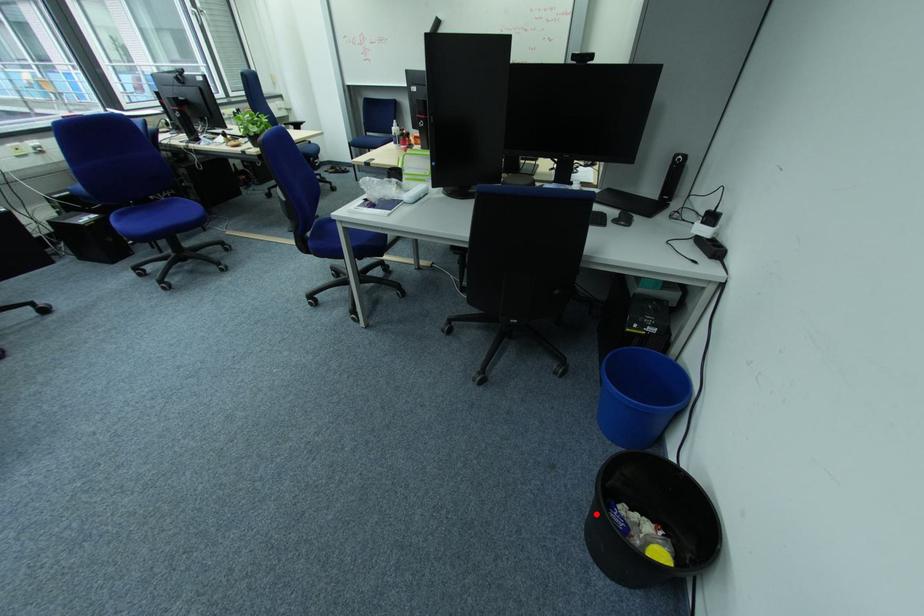
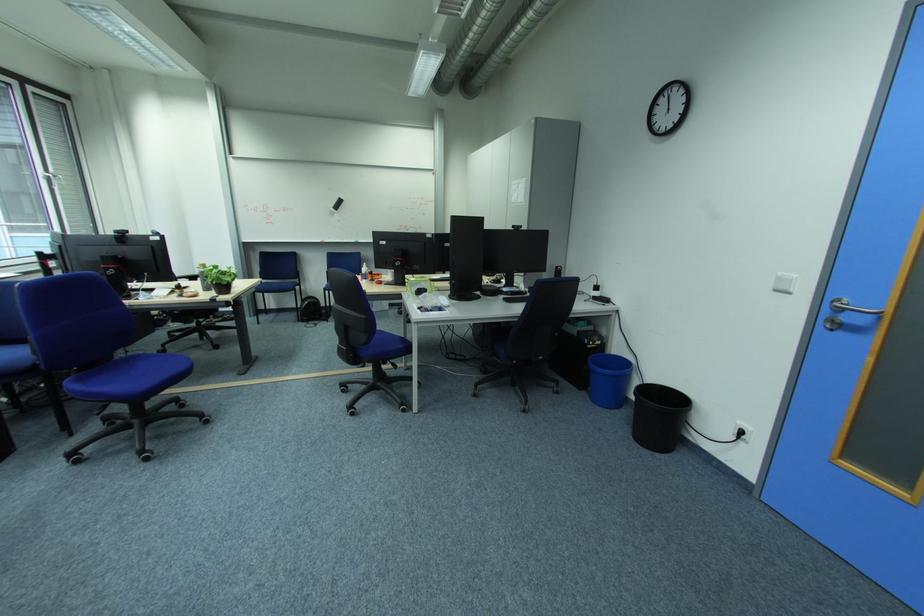
In the second image, find the point that corresponds to the highlighted location in the first image.

(640, 439)